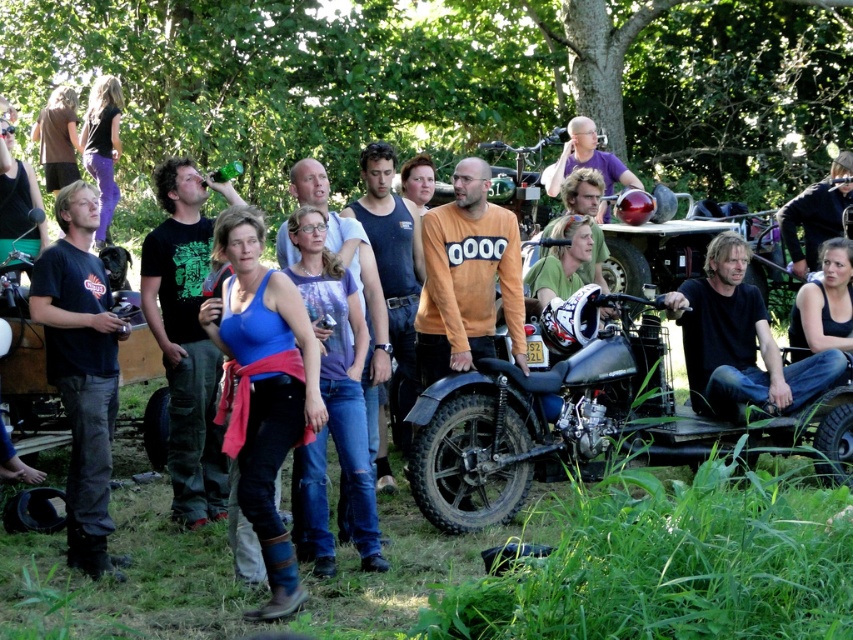
Is point (556, 308) less distant than point (791, 394)?

Yes, point (556, 308) is in front of point (791, 394).

Identify the location of matte black motorcycle at center. This screenshot has width=853, height=640. (544, 417).

At what (x,y) coordinates should I click in order to perform the action: click on matte black motorcycle at center. Please return your answer as a coordinate pair (x, y). Looking at the image, I should click on [x=544, y=417].

Can you confirm if black cotton t-shirt at left is positioned above dark brown leather jacket at lower right?

Incorrect, black cotton t-shirt at left is not positioned above dark brown leather jacket at lower right.

Which is more to the right, black cotton t-shirt at left or dark brown leather jacket at lower right?

From the viewer's perspective, dark brown leather jacket at lower right appears more on the right side.

Where is `black cotton t-shirt at left`? This screenshot has width=853, height=640. black cotton t-shirt at left is located at coordinates tap(80, 371).

Is matte blue tank top at center below dark brown leather jacket at lower right?

Indeed, matte blue tank top at center is positioned under dark brown leather jacket at lower right.

Looking at this image, between matte blue tank top at center and dark brown leather jacket at lower right, which one is positioned higher?

dark brown leather jacket at lower right

This screenshot has height=640, width=853. I want to click on matte blue tank top at center, so click(262, 388).

At what (x,y) coordinates should I click in order to perform the action: click on matte blue tank top at center. Please return your answer as a coordinate pair (x, y). Looking at the image, I should click on (262, 388).